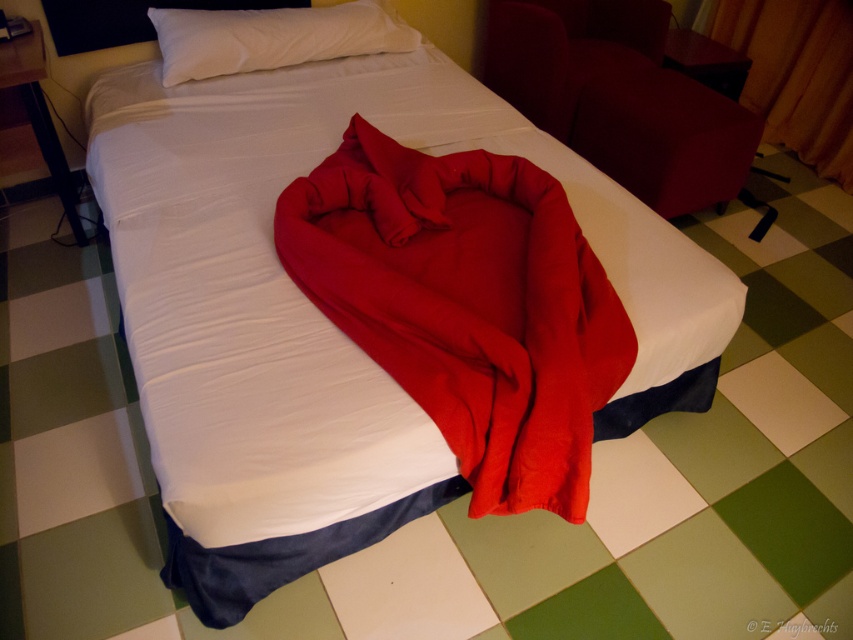
From the picture: You are a hotel guest who just arrived and wants to make sure there is enough space to place a 1.20 meter long luggage on the bed. The bed has a red soft fabric blanket at center. Can you place the luggage on the bed without folding the blanket?

The distance between the red soft fabric blanket at center and the camera is 1.30 meters. Since the luggage is 1.20 meters long, it can be placed on the bed without folding the blanket as there is sufficient space.

You are a hotel guest who wants to hang a small picture frame on the wall between the orange fabric curtain at upper right and the white soft pillow at upper center. Based on their widths, which object should you place the frame closer to to ensure it fits better?

The orange fabric curtain at upper right has a lesser width compared to the white soft pillow at upper center, so placing the frame closer to the orange fabric curtain at upper right would ensure it fits better due to its narrower width.